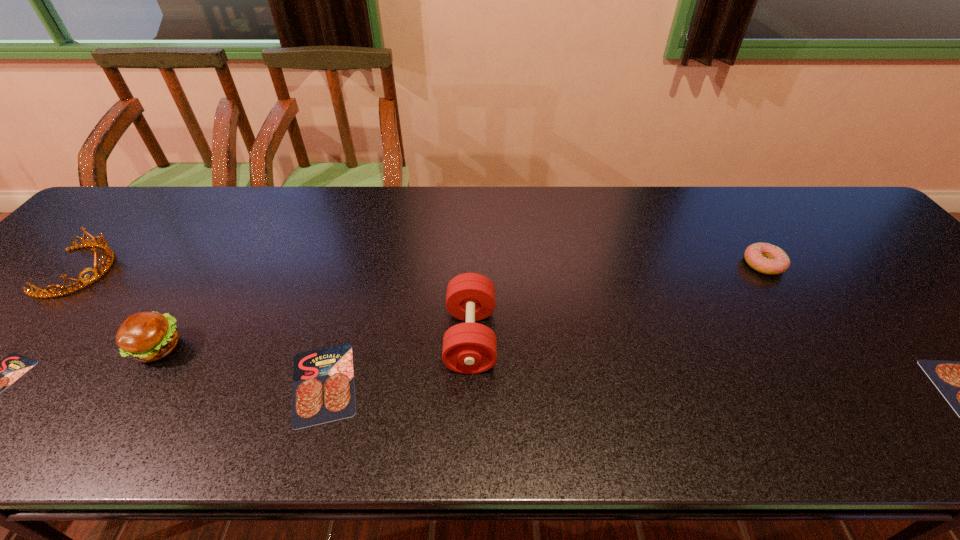
Please mark a free spot for a new salami to balance the arrangement. Please provide its 2D coordinates. Your answer should be formatted as a tuple, i.e. [(x, y)], where the tuple contains the x and y coordinates of a point satisfying the conditions above.

[(655, 387)]